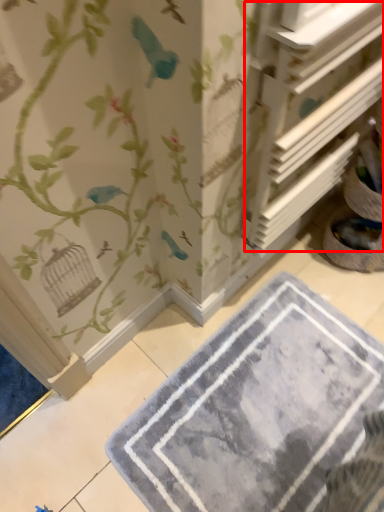
Question: From the image's perspective, where is shelf (annotated by the red box) located in relation to bath mat in the image?

Choices:
 (A) below
 (B) above

Answer: (B)